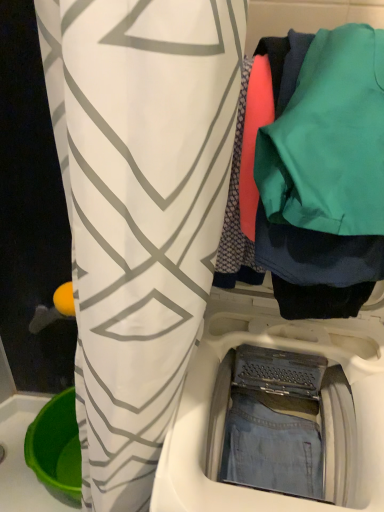
Question: In the image, is teal fabric at upper right on the left side or the right side of denim fabric washing machine at center?

Choices:
 (A) right
 (B) left

Answer: (A)

Question: From their relative heights in the image, would you say teal fabric at upper right is taller or shorter than denim fabric washing machine at center?

Choices:
 (A) tall
 (B) short

Answer: (B)

Question: Relative to denim fabric washing machine at center, is teal fabric at upper right in front or behind?

Choices:
 (A) front
 (B) behind

Answer: (A)

Question: From the image's perspective, is denim fabric washing machine at center located above or below teal fabric at upper right?

Choices:
 (A) above
 (B) below

Answer: (B)

Question: Would you say denim fabric washing machine at center is inside or outside teal fabric at upper right?

Choices:
 (A) outside
 (B) inside

Answer: (A)

Question: In the image, is denim fabric washing machine at center on the left side or the right side of teal fabric at upper right?

Choices:
 (A) right
 (B) left

Answer: (B)

Question: Is denim fabric washing machine at center wider or thinner than teal fabric at upper right?

Choices:
 (A) wide
 (B) thin

Answer: (A)